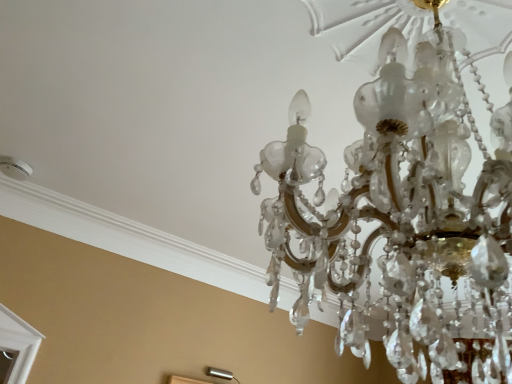
Question: Is silver metallic lamp at lower center, acting as the 2th lamp starting from the front, wider or thinner than clear crystal chandelier at upper center, the 2th lamp from the back?

Choices:
 (A) wide
 (B) thin

Answer: (B)

Question: Is silver metallic lamp at lower center, the 1th lamp viewed from the left, taller or shorter than clear crystal chandelier at upper center, the 2th lamp in the left-to-right sequence?

Choices:
 (A) short
 (B) tall

Answer: (A)

Question: Considering the positions of point (219, 377) and point (350, 291), is point (219, 377) closer or farther from the camera than point (350, 291)?

Choices:
 (A) closer
 (B) farther

Answer: (B)

Question: In terms of size, does clear crystal chandelier at upper center, which is counted as the 1th lamp, starting from the front, appear bigger or smaller than silver metallic lamp at lower center, acting as the 2th lamp starting from the front?

Choices:
 (A) small
 (B) big

Answer: (B)

Question: Looking at their shapes, would you say clear crystal chandelier at upper center, the 2th lamp in the left-to-right sequence, is wider or thinner than silver metallic lamp at lower center, acting as the 2th lamp starting from the right?

Choices:
 (A) wide
 (B) thin

Answer: (A)

Question: Does point (377, 127) appear closer or farther from the camera than point (206, 370)?

Choices:
 (A) farther
 (B) closer

Answer: (B)

Question: Is clear crystal chandelier at upper center, the 1th lamp from the top, spatially inside silver metallic lamp at lower center, the 1th lamp when ordered from bottom to top, or outside of it?

Choices:
 (A) outside
 (B) inside

Answer: (A)